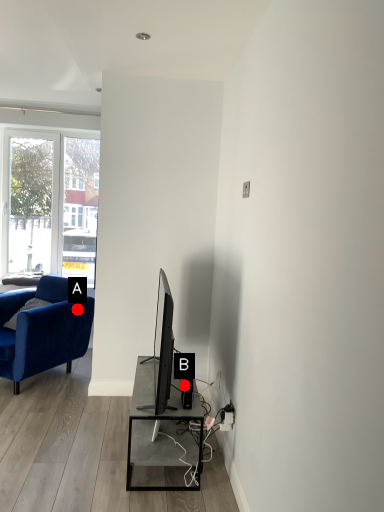
Question: Two points are circled on the image, labeled by A and B beside each circle. Which of the following is the closest to the observer?

Choices:
 (A) A is closer
 (B) B is closer

Answer: (B)